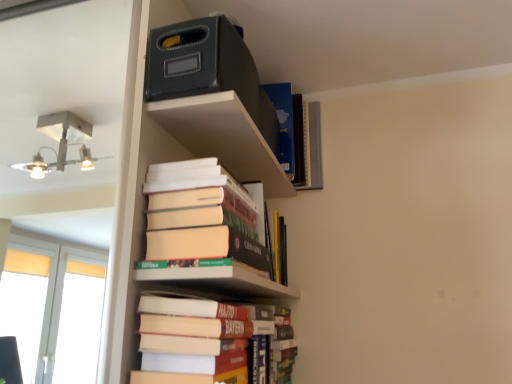
Question: Considering the relative sizes of hardcover books at center, which is counted as the 2th book, starting from the bottom, and hardcover book at center in the image provided, is hardcover books at center, which is counted as the 2th book, starting from the bottom, shorter than hardcover book at center?

Choices:
 (A) yes
 (B) no

Answer: (B)

Question: Is hardcover books at center, the 2th book positioned from the top, not near hardcover book at center?

Choices:
 (A) yes
 (B) no

Answer: (B)

Question: From the image's perspective, would you say hardcover books at center, the 2th book positioned from the top, is positioned over hardcover book at center?

Choices:
 (A) no
 (B) yes

Answer: (B)

Question: Is hardcover books at center, the 2th book positioned from the top, wider than hardcover book at center?

Choices:
 (A) no
 (B) yes

Answer: (B)

Question: Is hardcover books at center, which is counted as the 2th book, starting from the bottom, further to the viewer compared to hardcover book at center?

Choices:
 (A) yes
 (B) no

Answer: (A)

Question: Could you tell me if hardcover books at center, which is counted as the 2th book, starting from the bottom, is turned towards hardcover book at center?

Choices:
 (A) no
 (B) yes

Answer: (A)

Question: From a real-world perspective, is hardcover books at lower center, the 3th book positioned from the top, positioned over hardcover books at center, the 2th book positioned from the top, based on gravity?

Choices:
 (A) yes
 (B) no

Answer: (B)

Question: Is hardcover books at lower center, the 3th book positioned from the top, to the right of hardcover books at center, which is counted as the 2th book, starting from the bottom, from the viewer's perspective?

Choices:
 (A) no
 (B) yes

Answer: (A)

Question: Does hardcover books at lower center, the 3th book positioned from the top, have a greater width compared to hardcover books at center, which is counted as the 2th book, starting from the bottom?

Choices:
 (A) yes
 (B) no

Answer: (B)

Question: Does hardcover books at lower center, the 3th book positioned from the top, lie behind hardcover books at center, which is counted as the 2th book, starting from the bottom?

Choices:
 (A) no
 (B) yes

Answer: (A)

Question: Can you confirm if hardcover books at lower center, which is counted as the 1th book, starting from the bottom, is smaller than hardcover books at center, the 2th book positioned from the top?

Choices:
 (A) yes
 (B) no

Answer: (A)

Question: From the image's perspective, is hardcover books at lower center, which is counted as the 1th book, starting from the bottom, under hardcover books at center, which is counted as the 2th book, starting from the bottom?

Choices:
 (A) no
 (B) yes

Answer: (B)

Question: Is hardcover book at upper center, marked as the third book in a bottom-to-top arrangement, wider than hardcover books at lower center, the 3th book positioned from the top?

Choices:
 (A) yes
 (B) no

Answer: (A)